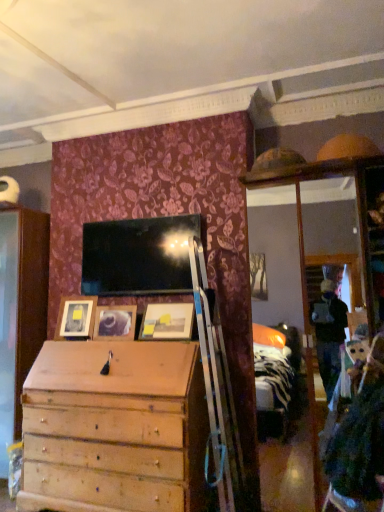
Question: Which direction should I rotate to face wooden picture frame at center, the second picture frame from the left, — up or down?

Choices:
 (A) down
 (B) up

Answer: (A)

Question: Considering the relative sizes of matte wooden picture frame at center, positioned as the first picture frame in right-to-left order, and wooden picture frame at center, the second picture frame from the left, in the image provided, is matte wooden picture frame at center, positioned as the first picture frame in right-to-left order, thinner than wooden picture frame at center, the second picture frame from the left,?

Choices:
 (A) yes
 (B) no

Answer: (B)

Question: From the image's perspective, is matte wooden picture frame at center, which is the third picture frame in left-to-right order, beneath wooden picture frame at center, positioned as the 2th picture frame in right-to-left order?

Choices:
 (A) yes
 (B) no

Answer: (B)

Question: From a real-world perspective, is matte wooden picture frame at center, which is the third picture frame in left-to-right order, located higher than wooden picture frame at center, the second picture frame from the left?

Choices:
 (A) yes
 (B) no

Answer: (A)

Question: Considering the relative sizes of matte wooden picture frame at center, positioned as the first picture frame in right-to-left order, and wooden picture frame at center, the second picture frame from the left, in the image provided, is matte wooden picture frame at center, positioned as the first picture frame in right-to-left order, shorter than wooden picture frame at center, the second picture frame from the left,?

Choices:
 (A) yes
 (B) no

Answer: (B)

Question: Is matte wooden picture frame at center, positioned as the first picture frame in right-to-left order, outside of wooden picture frame at center, the second picture frame from the left?

Choices:
 (A) yes
 (B) no

Answer: (A)

Question: Does matte wooden picture frame at center, which is the third picture frame in left-to-right order, have a greater width compared to wooden picture frame at center, positioned as the 2th picture frame in right-to-left order?

Choices:
 (A) yes
 (B) no

Answer: (A)

Question: Does matte wooden picture frame at left, acting as the third picture frame starting from the right, appear on the left side of wooden picture frame at center, positioned as the 2th picture frame in right-to-left order?

Choices:
 (A) yes
 (B) no

Answer: (A)

Question: Would you say wooden picture frame at center, the second picture frame from the left, is part of matte wooden picture frame at left, which is counted as the first picture frame, starting from the left,'s contents?

Choices:
 (A) no
 (B) yes

Answer: (A)

Question: Is matte wooden picture frame at left, which is counted as the first picture frame, starting from the left, closer to camera compared to wooden picture frame at center, the second picture frame from the left?

Choices:
 (A) yes
 (B) no

Answer: (B)

Question: Is matte wooden picture frame at left, acting as the third picture frame starting from the right, bigger than wooden picture frame at center, positioned as the 2th picture frame in right-to-left order?

Choices:
 (A) yes
 (B) no

Answer: (A)

Question: Can you confirm if matte wooden picture frame at left, which is counted as the first picture frame, starting from the left, is positioned to the right of wooden picture frame at center, the second picture frame from the left?

Choices:
 (A) yes
 (B) no

Answer: (B)

Question: Is matte wooden picture frame at left, which is counted as the first picture frame, starting from the left, not within wooden picture frame at center, the second picture frame from the left?

Choices:
 (A) no
 (B) yes

Answer: (B)

Question: Can you see matte wooden picture frame at left, acting as the third picture frame starting from the right, touching matte wooden picture frame at center, positioned as the first picture frame in right-to-left order?

Choices:
 (A) yes
 (B) no

Answer: (B)